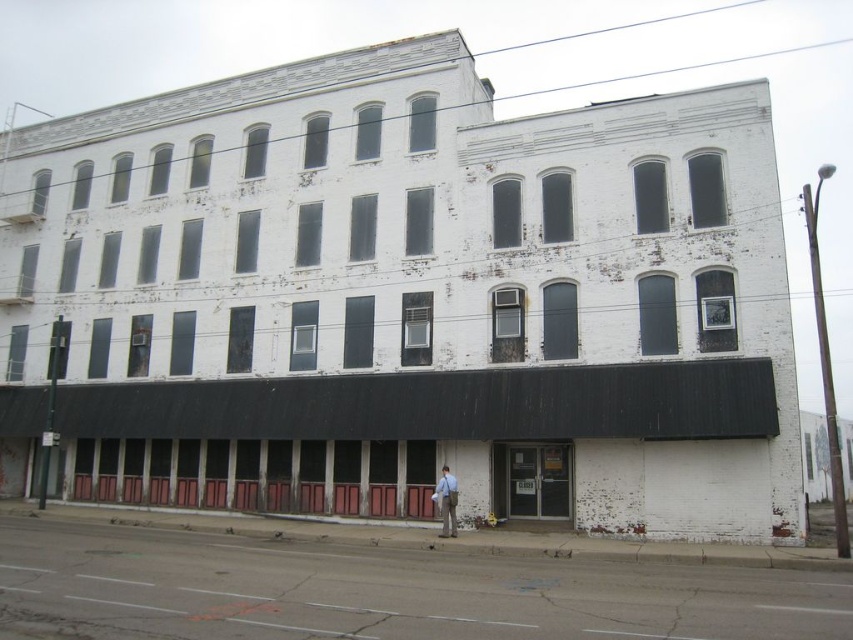
You are a delivery person trying to enter the building through the matte glass door at lower center. However, you are carrying a large light brown leather jacket at center. Will the jacket fit through the door?

The matte glass door at lower center has a larger size compared to the light brown leather jacket at center, so the jacket should fit through the door.

You are standing in front of the building and want to take a photo. You notice two points marked on the facade. The first point is at coordinate point (502,486) and the second is at point (445,481). Which point will appear closer to the bottom of your camera frame?

Point (445,481) is closer to the bottom of the camera frame because it is closer to the camera than point (502,486), which is further away. Since it is nearer, it would be positioned lower in the frame.